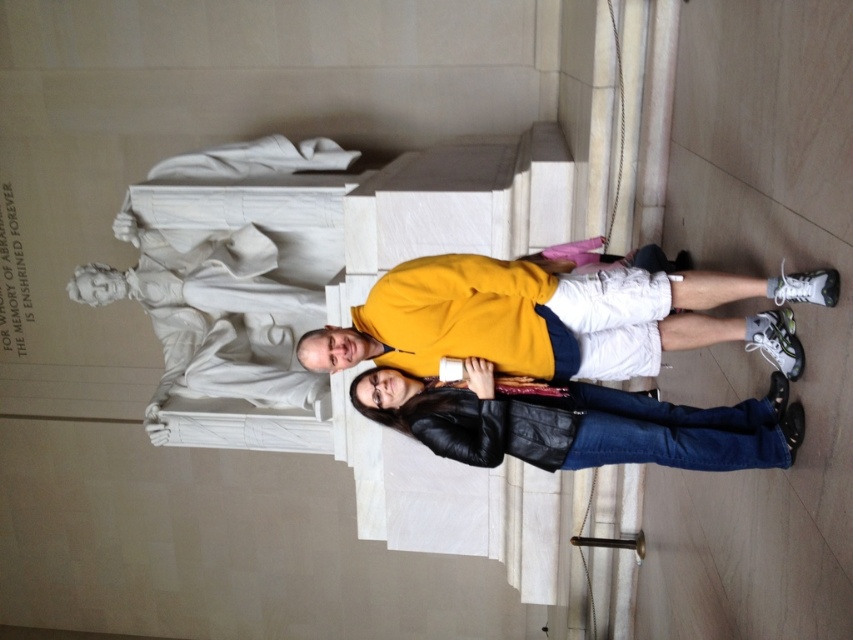
Question: Is the position of yellow matte sweatshirt at center more distant than that of black leather jacket at center?

Choices:
 (A) no
 (B) yes

Answer: (A)

Question: Among these points, which one is farthest from the camera?

Choices:
 (A) (653, 371)
 (B) (396, 428)

Answer: (B)

Question: Does yellow matte sweatshirt at center appear on the left side of black leather jacket at center?

Choices:
 (A) yes
 (B) no

Answer: (A)

Question: Which object is closer to the camera taking this photo?

Choices:
 (A) yellow matte sweatshirt at center
 (B) black leather jacket at center

Answer: (A)

Question: In this image, where is yellow matte sweatshirt at center located relative to black leather jacket at center?

Choices:
 (A) below
 (B) above

Answer: (B)